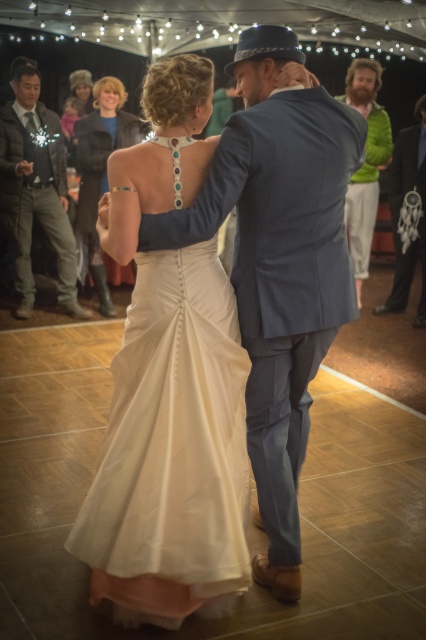
You are a photographer at the wedding reception. You want to take a photo that includes both the satin dress at center and the dark green jacket at left. Which object should you focus on first to ensure both are in the frame?

The satin dress at center is closer to the viewer than the dark green jacket at left, so you should focus on the satin dress at center first to ensure both are in the frame.

You are standing at the point marked as point (120, 497) at the wedding reception. You want to hand a gift to the couple dancing on the wooden dance floor. Can you reach them without moving from your current position? The average distance between a guest and the dance floor is 2 meters.

The distance between you and the couple is 2.33 meters, which is slightly more than the average distance of 2 meters. Therefore, you might need to step forward a little to reach them.

You are standing at the entrance of the wedding reception tent and want to take a photo that includes both the point at coordinates point [86,205] and the point at coordinates point [417,196]. Which point is closer to you so that you can focus on it first?

Answer: Point [86,205] is closer to you than point [417,196], so you should focus on it first.